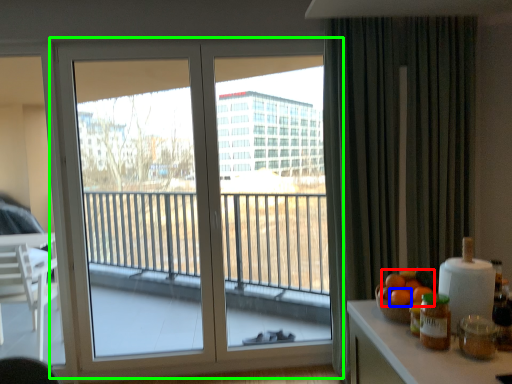
Question: Estimate the real-world distances between objects in this image. Which object is farther from orange (highlighted by a red box), orange (highlighted by a blue box) or window (highlighted by a green box)?

Choices:
 (A) orange
 (B) window

Answer: (B)